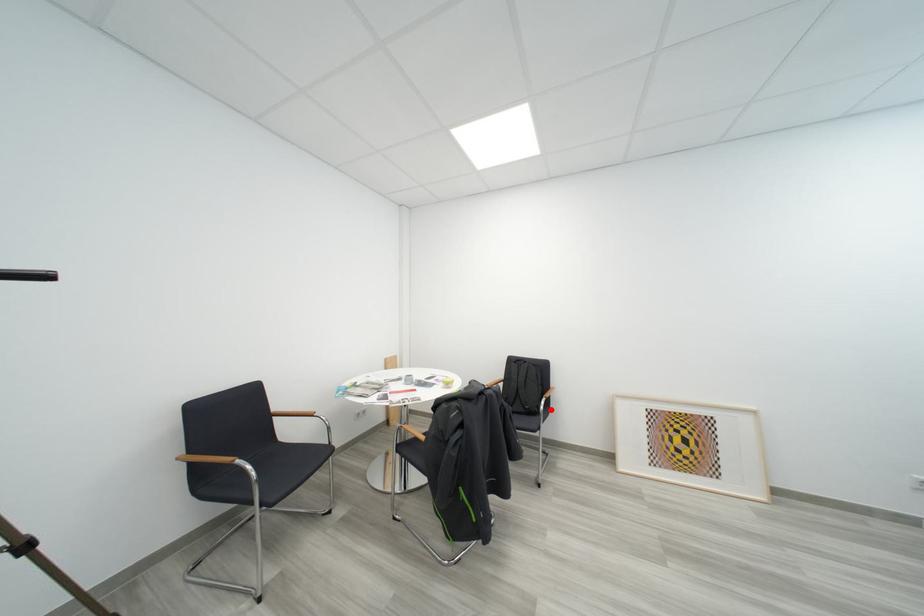
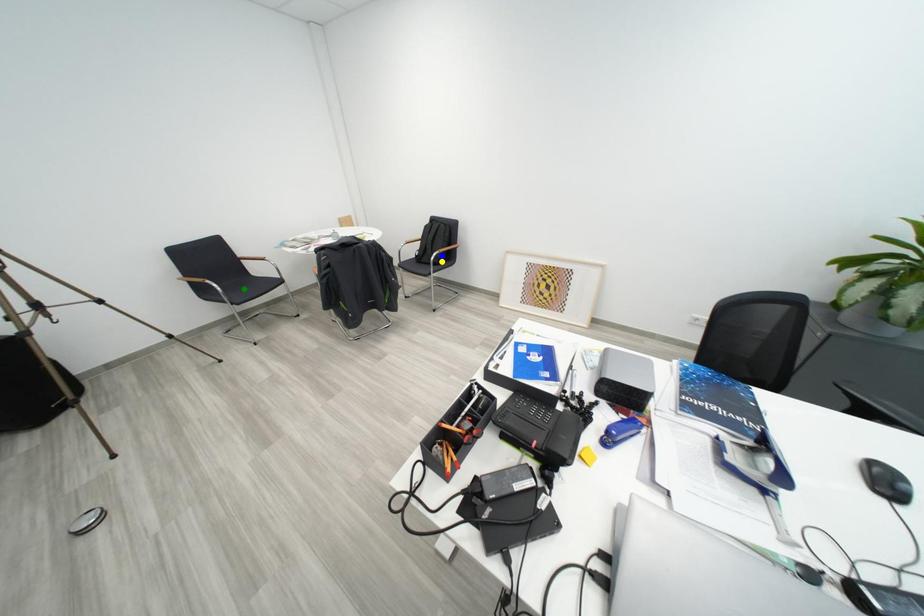
Question: I am providing you with two images of the same scene from different viewpoints. A red point is marked on the first image. You are given multiple points on the second image. Which point in image 2 is actually the same real-world point as the red point in image 1?

Choices:
 (A) green point
 (B) blue point
 (C) yellow point

Answer: (C)